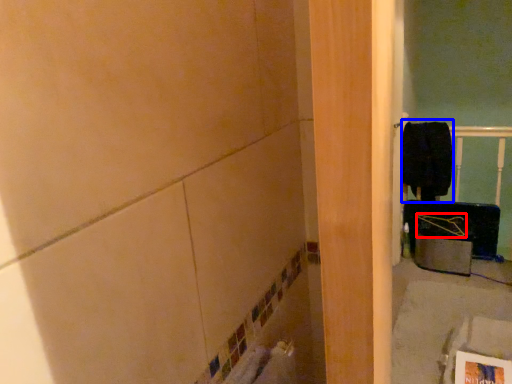
Question: Which point is closer to the camera, job (highlighted by a red box) or laundry (highlighted by a blue box)?

Choices:
 (A) job
 (B) laundry

Answer: (A)